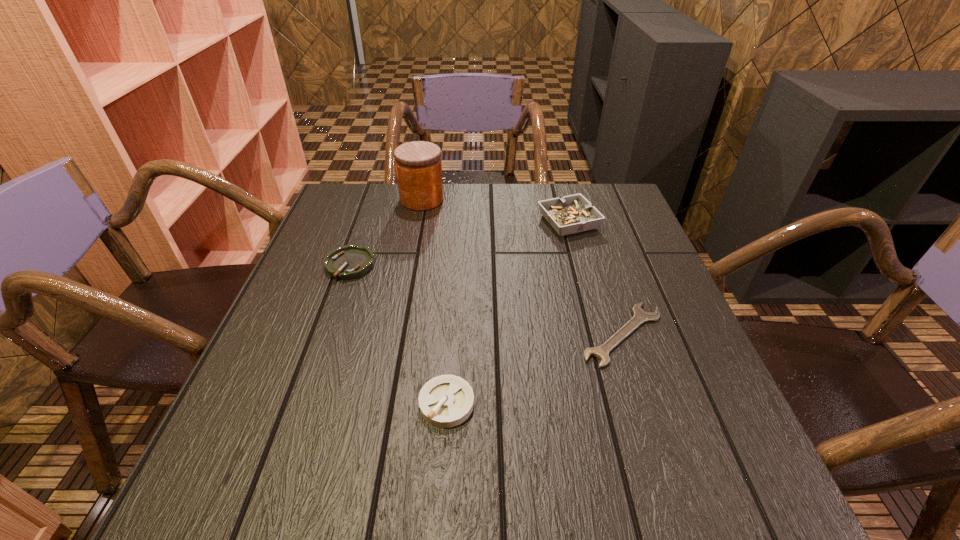
The image size is (960, 540). What are the coordinates of `vacant area located 0.080m on the front of the tallest ashtray` in the screenshot? It's located at (579, 259).

What are the coordinates of `free space located on the right of the second ashtray from right to left` in the screenshot? It's located at (508, 403).

The image size is (960, 540). What are the coordinates of `vacant region located 0.210m on the right of the leftmost object` in the screenshot? It's located at (460, 265).

This screenshot has height=540, width=960. I want to click on free space located 0.050m on the front of the fourth farthest object, so click(x=641, y=391).

You are a GUI agent. You are given a task and a screenshot of the screen. Output one action in this format:
    pyautogui.click(x=<x>, y=<y>)
    Task: Click on the jar that is at the far edge
    
    Given the screenshot: What is the action you would take?
    pyautogui.click(x=418, y=164)

Locate an element on the screen. ashtray situated at the far edge is located at coordinates (571, 214).

Locate an element on the screen. The height and width of the screenshot is (540, 960). object positioned at the left edge is located at coordinates (347, 262).

The height and width of the screenshot is (540, 960). I want to click on ashtray situated at the right edge, so click(x=571, y=214).

Where is `wrench at the right edge`? The height and width of the screenshot is (540, 960). wrench at the right edge is located at coordinates (640, 316).

This screenshot has width=960, height=540. In order to click on object that is at the far right corner in this screenshot , I will do `click(571, 214)`.